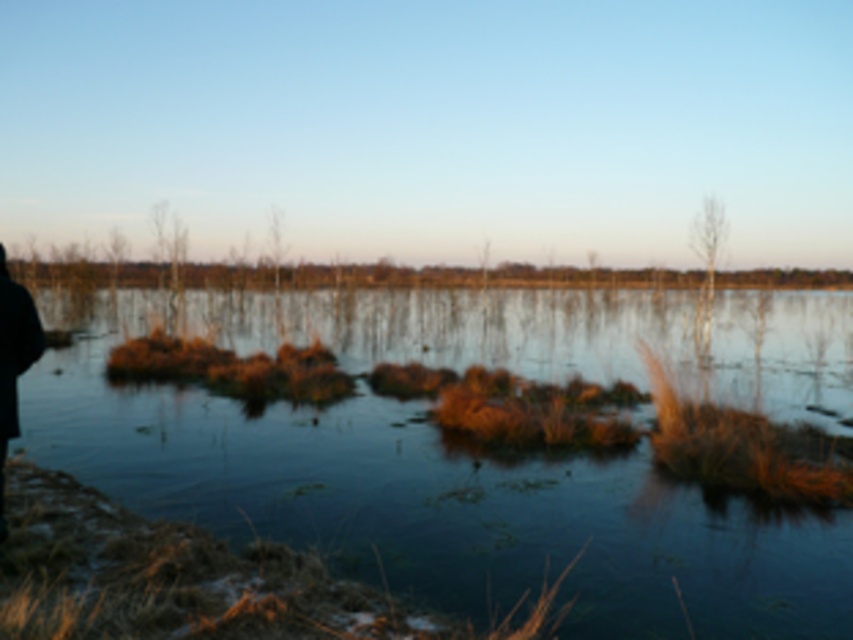
Question: Which point is farther from the camera taking this photo?

Choices:
 (A) (0, 321)
 (B) (480, 529)

Answer: (B)

Question: Is brown grassy lake at center to the right of black fabric person at left from the viewer's perspective?

Choices:
 (A) yes
 (B) no

Answer: (A)

Question: Can you confirm if brown grassy lake at center is smaller than black fabric person at left?

Choices:
 (A) yes
 (B) no

Answer: (B)

Question: Among these objects, which one is farthest from the camera?

Choices:
 (A) brown grassy lake at center
 (B) black fabric person at left

Answer: (B)

Question: Which point is closer to the camera?

Choices:
 (A) [24, 320]
 (B) [724, 336]

Answer: (A)

Question: Does brown grassy lake at center come behind black fabric person at left?

Choices:
 (A) yes
 (B) no

Answer: (B)